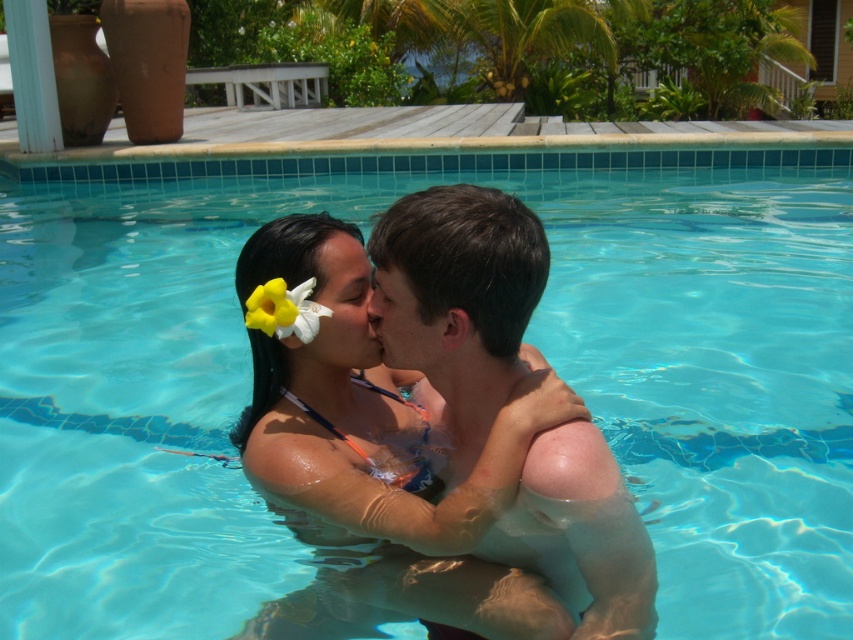
Can you confirm if yellow matte flower at upper center is bigger than smooth skin nose at center?

Indeed, yellow matte flower at upper center has a larger size compared to smooth skin nose at center.

Locate an element on the screen. This screenshot has height=640, width=853. yellow matte flower at upper center is located at coordinates (283, 308).

Between smooth skin man at center and yellow matte flower at upper center, which one is positioned lower?

smooth skin man at center is lower down.

This screenshot has height=640, width=853. Describe the element at coordinates (457, 301) in the screenshot. I see `smooth skin man at center` at that location.

Image resolution: width=853 pixels, height=640 pixels. What are the coordinates of `smooth skin man at center` in the screenshot? It's located at (457, 301).

Measure the distance from smooth skin man at center to smooth skin nose at center.

smooth skin man at center is 14.42 inches away from smooth skin nose at center.

Is point (607, 449) less distant than point (375, 321)?

Yes, point (607, 449) is in front of point (375, 321).

Find the location of `smooth skin man at center`. smooth skin man at center is located at coordinates (457, 301).